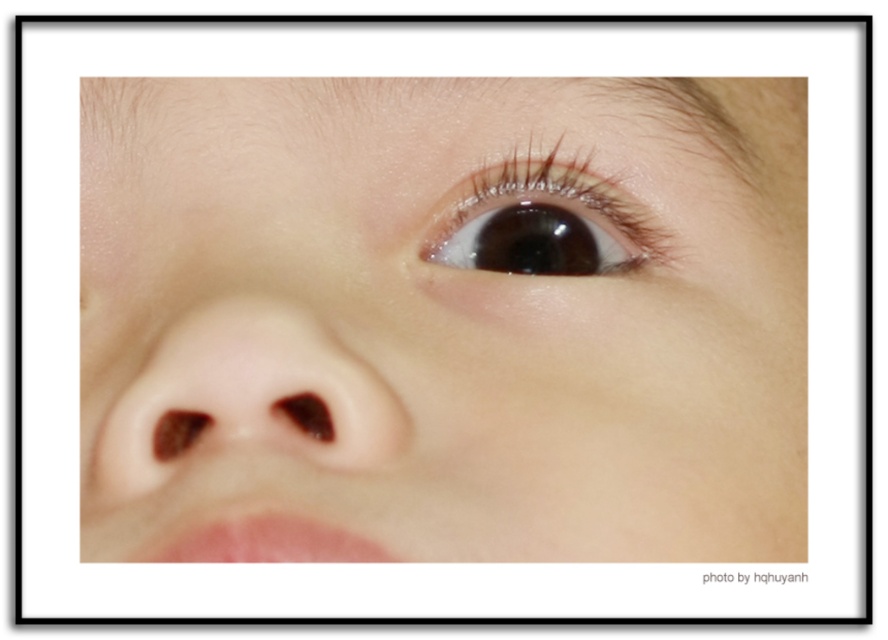
You are a makeup artist preparing to apply eyeliner on the smooth skin eye at upper center and the glossy brown eye at upper center. Since both eyes are in the same face, which eye requires a thicker eyeliner application to compensate for its size?

The smooth skin eye at upper center is bigger than the glossy brown eye at upper center, so the glossy brown eye at upper center requires a thicker eyeliner to balance the size difference between the two eyes.